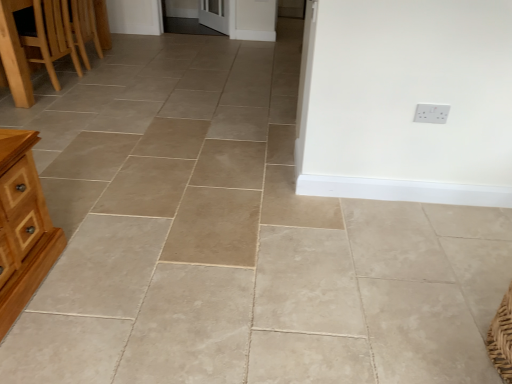
Question: Does point (440, 117) appear closer or farther from the camera than point (8, 38)?

Choices:
 (A) closer
 (B) farther

Answer: (A)

Question: From their relative heights in the image, would you say white plastic electric outlet at upper right is taller or shorter than wooden chair at left?

Choices:
 (A) short
 (B) tall

Answer: (A)

Question: Based on their relative distances, which object is nearer to the wooden chair at left?

Choices:
 (A) light brown wooden table at left
 (B) white plastic electric outlet at upper right

Answer: (A)

Question: Considering the real-world distances, which object is closest to the light brown wooden table at left?

Choices:
 (A) wooden chair at left
 (B) white plastic electric outlet at upper right

Answer: (A)